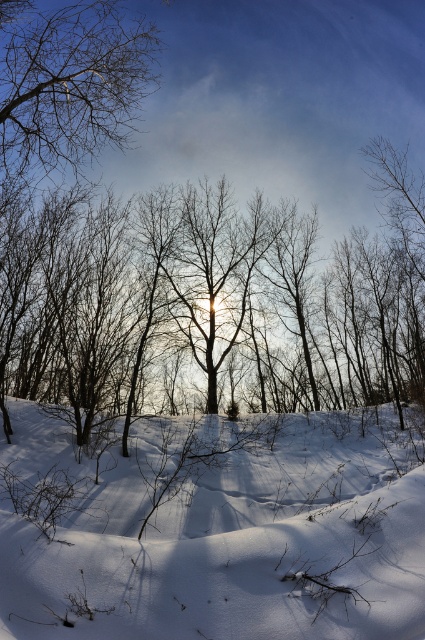
You are an artist planning to paint the winter scene. You want to ensure the brown bark tree at center and the brown textured branches at upper left are proportionate. Which object should you depict as taller in your painting?

The brown bark tree at center should be depicted as taller in the painting since it has a greater height compared to the brown textured branches at upper left according to the scene description.

You are an artist trying to sketch this winter scene. You want to ensure the brown textured branches at upper left and the brown bark tree at center are positioned correctly in terms of depth. Which object should appear closer to you in your drawing?

The brown bark tree at center should appear closer to you in your drawing because the brown textured branches at upper left is behind it.